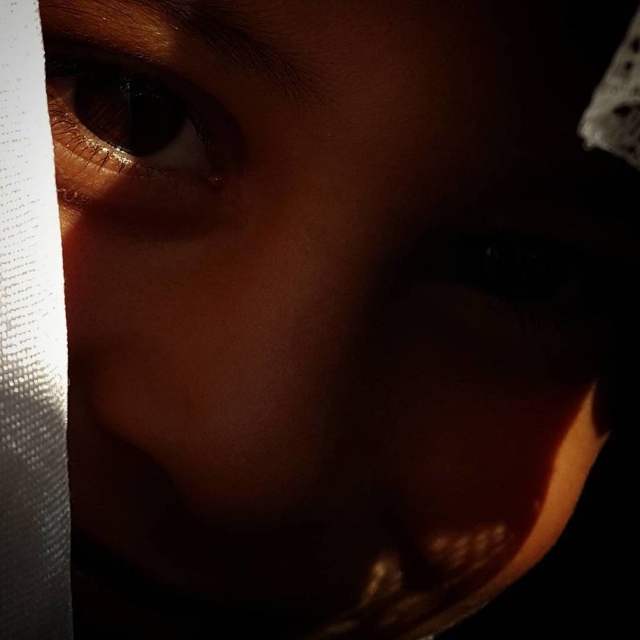
You are an artist trying to sketch this portrait. You need to position the brown matte eye at upper left and the black matte eye at center accurately. According to the scene, which eye is positioned to the left of the other?

The brown matte eye at upper left is positioned to the left of the black matte eye at center.

You are a photographer adjusting the lighting for a portrait. The subject has a brown matte eye at upper left positioned at point (132, 134). To ensure the eye is well lit, where should you place the light source relative to the eye?

The light source should be placed to the upper left of the brown matte eye at upper left to match the direction of the existing lighting, which comes from the upper left corner as indicated by the bright reflection on the cheek.

You are a photographer adjusting the lighting for a portrait. You notice the brown matte eye at upper left and the black matte eye at center. Which eye is positioned higher on the face?

The brown matte eye at upper left is located above the black matte eye at center, so it is positioned higher on the face.